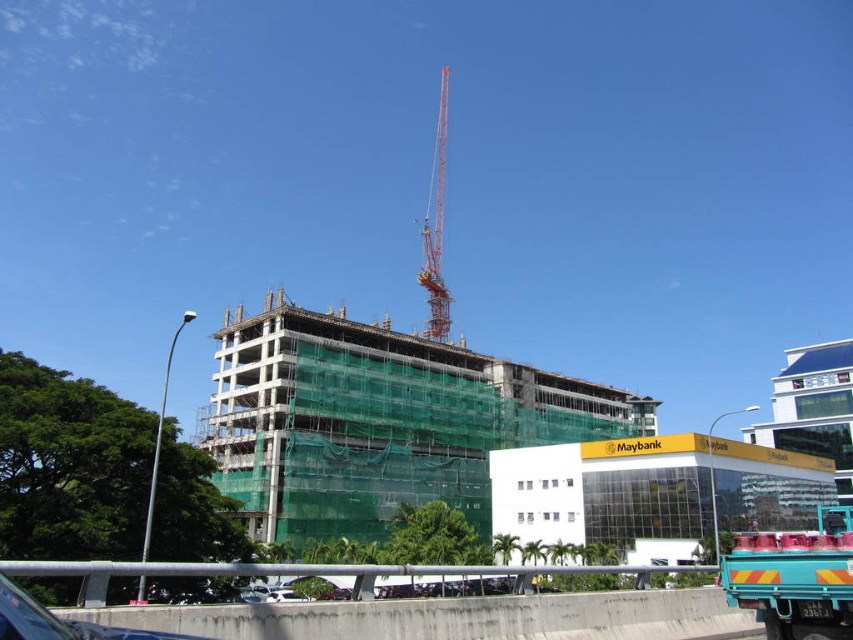
Can you confirm if teal matte truck at lower right is smaller than orange metallic crane at upper center?

Indeed, teal matte truck at lower right has a smaller size compared to orange metallic crane at upper center.

Image resolution: width=853 pixels, height=640 pixels. Describe the element at coordinates (793, 577) in the screenshot. I see `teal matte truck at lower right` at that location.

Identify the location of teal matte truck at lower right. pyautogui.click(x=793, y=577).